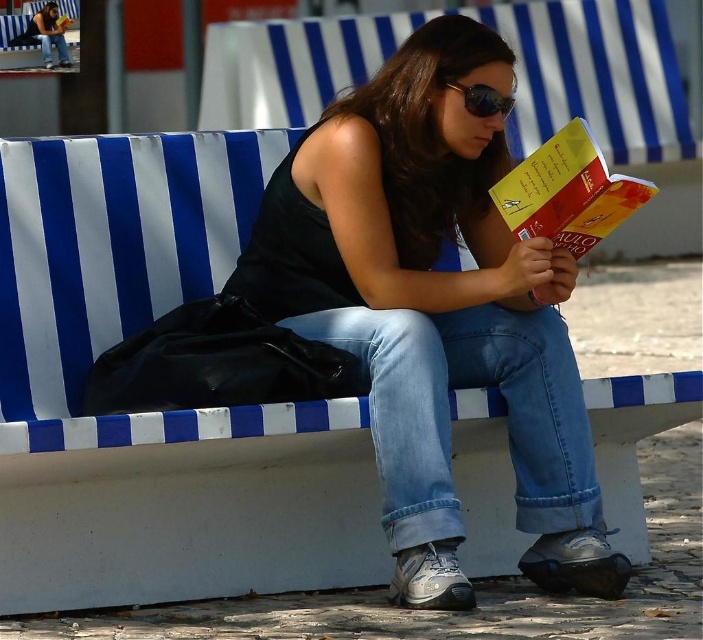
Question: Which object is farther from the camera taking this photo?

Choices:
 (A) matte black tank top at center
 (B) yellow paper at center

Answer: (A)

Question: Does yellow paper at center have a greater width compared to sunglasses at center?

Choices:
 (A) no
 (B) yes

Answer: (B)

Question: Does matte black tank top at center have a smaller size compared to sunglasses at center?

Choices:
 (A) no
 (B) yes

Answer: (A)

Question: Is matte black tank top at center to the right of sunglasses at center from the viewer's perspective?

Choices:
 (A) yes
 (B) no

Answer: (B)

Question: Which object is positioned farthest from the matte black tank top at center?

Choices:
 (A) sunglasses at center
 (B) yellow paper at center

Answer: (A)

Question: Among these points, which one is nearest to the camera?

Choices:
 (A) (553, 301)
 (B) (483, 106)

Answer: (B)